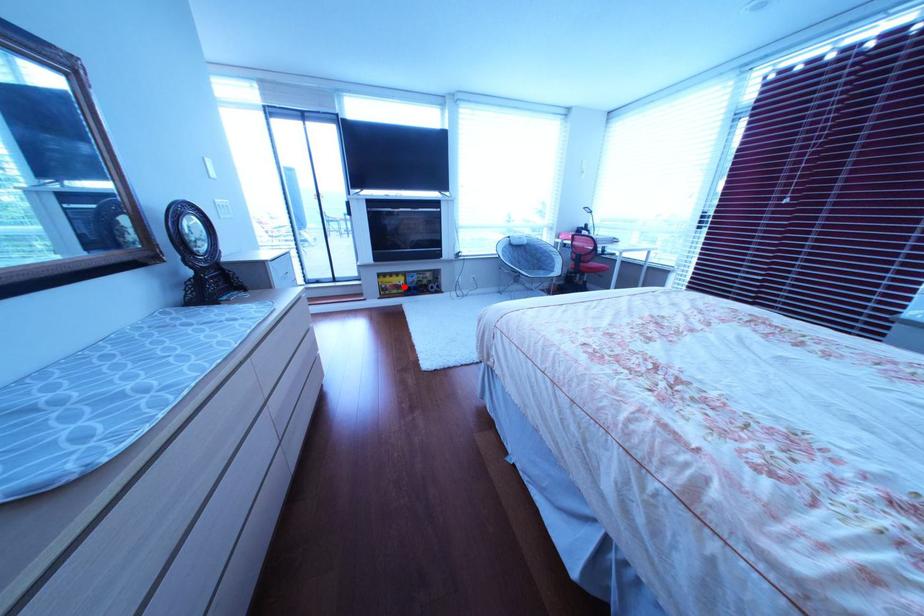
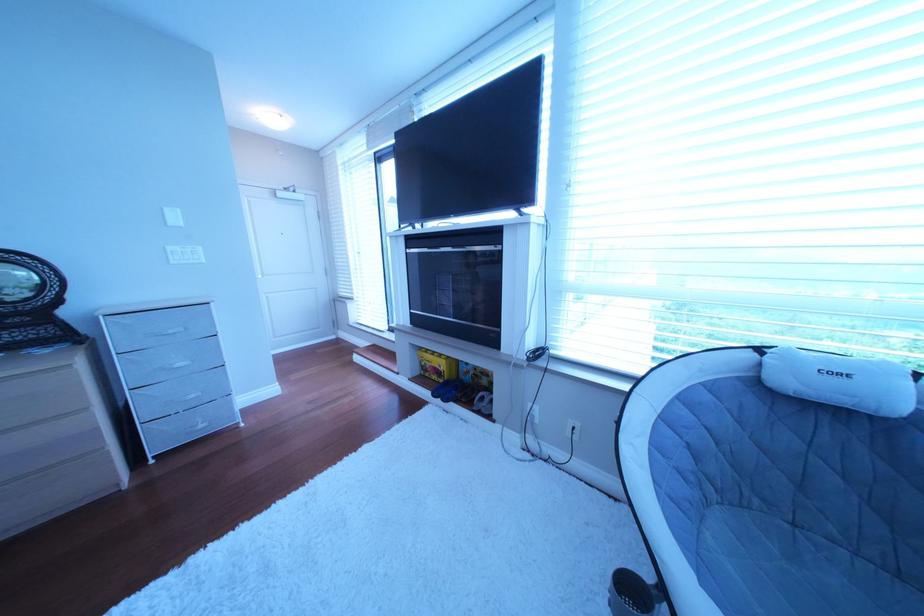
Where in the second image is the point corresponding to the highlighted location from the first image?

(444, 367)